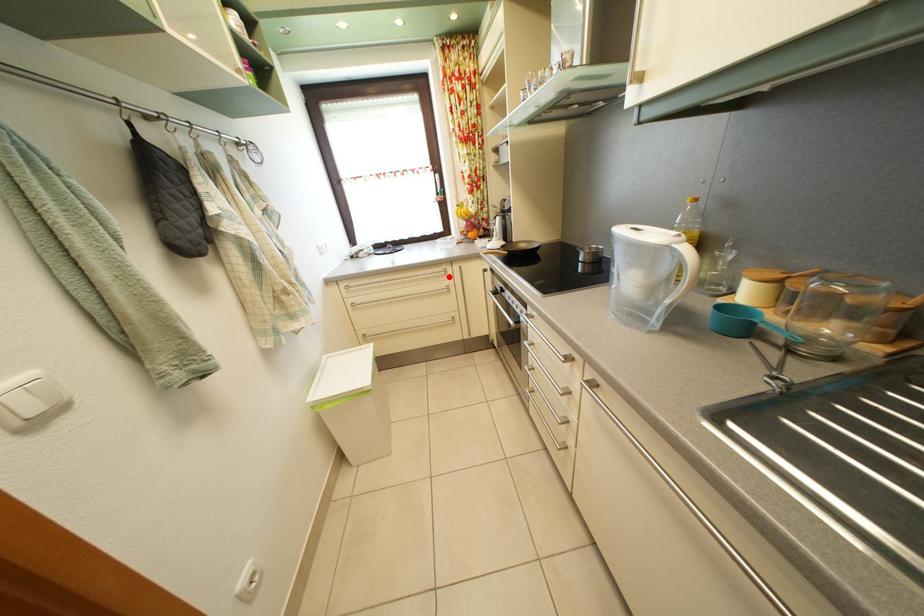
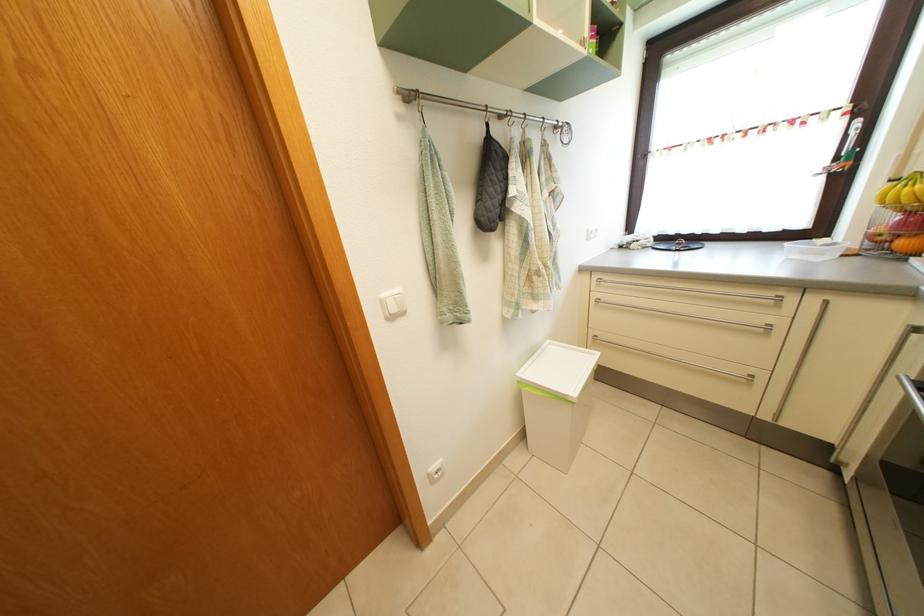
Question: I am providing you with two images of the same scene from different viewpoints. Image1 has a red point marked. In image2, the corresponding 3D location appears at what relative position? Reply with the corresponding letter.

Choices:
 (A) Closer
 (B) Farther

Answer: (B)